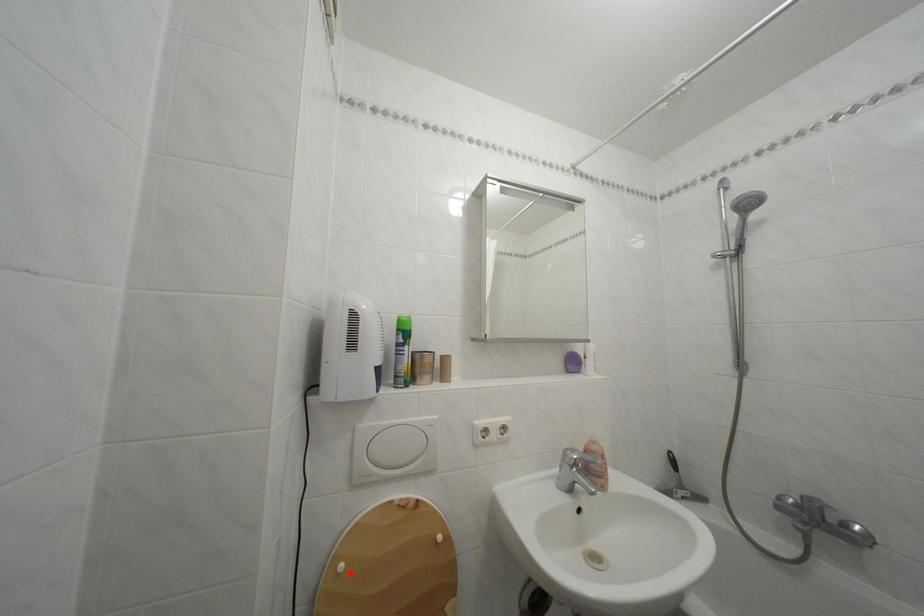
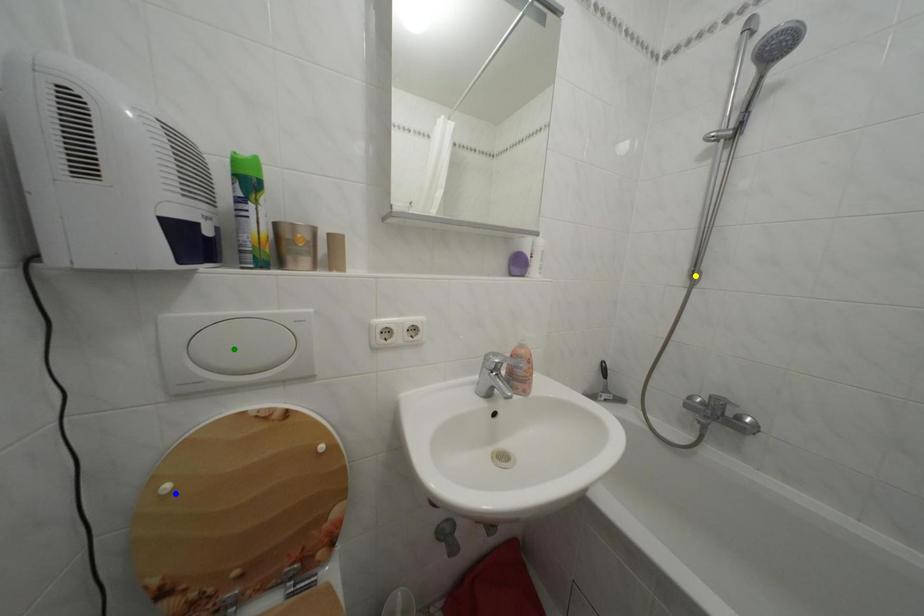
Question: I am providing you with two images of the same scene from different viewpoints. A red point is marked on the first image. You are given multiple points on the second image. In image 2, which mark is for the same physical point as the one in image 1?

Choices:
 (A) green point
 (B) blue point
 (C) yellow point

Answer: (B)